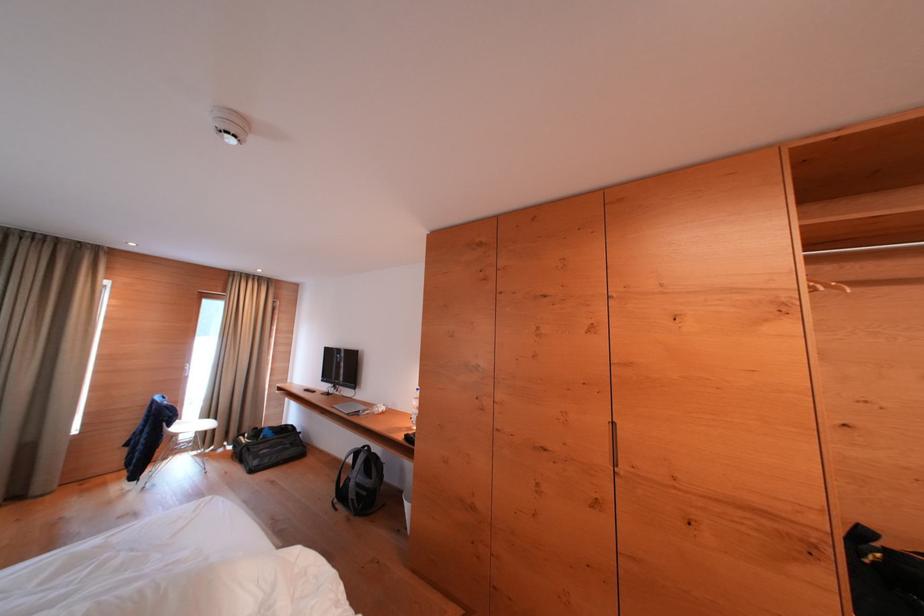
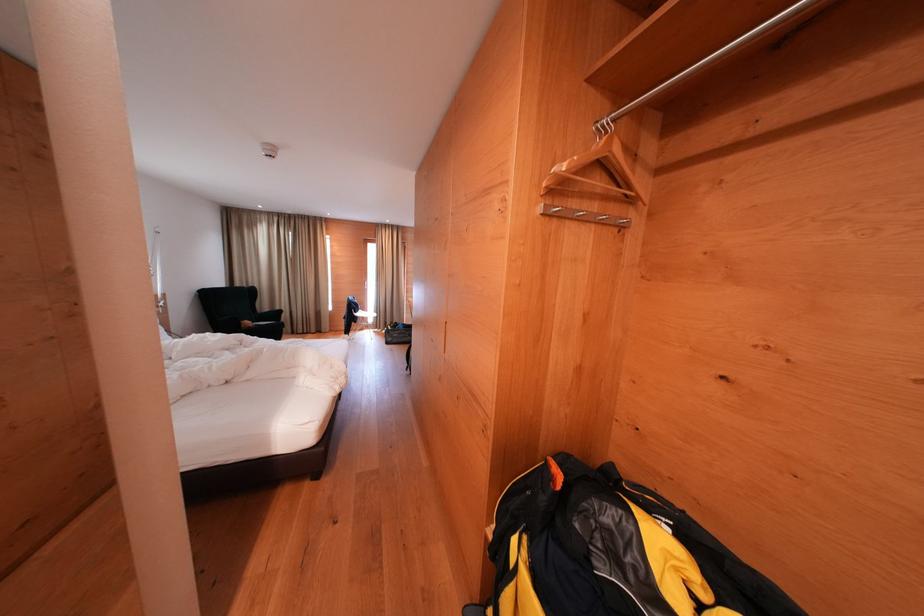
The point at [199,429] is marked in the first image. Where is the corresponding point in the second image?

(374, 318)